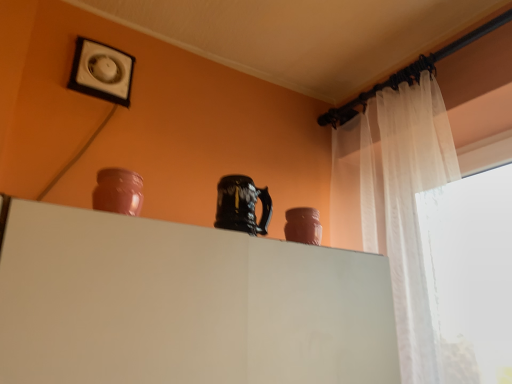
Question: From the image's perspective, does matte pink vase at right, acting as the 2th vase starting from the top, appear lower than white glossy vent at upper left?

Choices:
 (A) yes
 (B) no

Answer: (A)

Question: From a real-world perspective, does matte pink vase at right, which is counted as the 1th vase, starting from the back, stand above white glossy vent at upper left?

Choices:
 (A) yes
 (B) no

Answer: (B)

Question: Does matte pink vase at right, which is counted as the 1th vase, starting from the back, have a greater height compared to white glossy vent at upper left?

Choices:
 (A) yes
 (B) no

Answer: (B)

Question: Would you say matte pink vase at right, which is counted as the 1th vase, starting from the back, is outside white glossy vent at upper left?

Choices:
 (A) yes
 (B) no

Answer: (A)

Question: Is the position of matte pink vase at right, acting as the 2th vase starting from the left, less distant than that of white glossy vent at upper left?

Choices:
 (A) no
 (B) yes

Answer: (B)

Question: From the image's perspective, would you say matte pink vase at right, arranged as the 1th vase when ordered from the bottom, is positioned over white glossy vent at upper left?

Choices:
 (A) no
 (B) yes

Answer: (A)

Question: Is glossy ceramic mug at upper center positioned with its back to matte clay vase at upper left, which appears as the second vase when viewed from the back?

Choices:
 (A) yes
 (B) no

Answer: (B)

Question: Does glossy ceramic mug at upper center have a smaller size compared to matte clay vase at upper left, which ranks as the 1th vase in left-to-right order?

Choices:
 (A) no
 (B) yes

Answer: (A)

Question: Is glossy ceramic mug at upper center completely or partially outside of matte clay vase at upper left, which ranks as the 1th vase in left-to-right order?

Choices:
 (A) no
 (B) yes

Answer: (B)

Question: Is glossy ceramic mug at upper center far from matte clay vase at upper left, the first vase when ordered from front to back?

Choices:
 (A) no
 (B) yes

Answer: (A)

Question: From a real-world perspective, does glossy ceramic mug at upper center stand above matte clay vase at upper left, which ranks as the 1th vase in left-to-right order?

Choices:
 (A) yes
 (B) no

Answer: (A)

Question: Is glossy ceramic mug at upper center to the right of matte clay vase at upper left, the first vase when ordered from front to back, from the viewer's perspective?

Choices:
 (A) yes
 (B) no

Answer: (A)

Question: From a real-world perspective, does matte pink vase at right, acting as the 2th vase starting from the left, sit lower than matte clay vase at upper left, which appears as the second vase when viewed from the back?

Choices:
 (A) yes
 (B) no

Answer: (B)